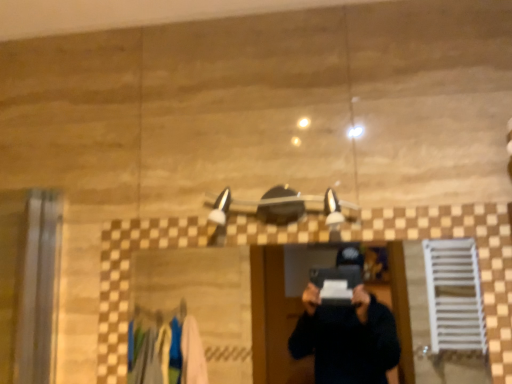
Find the location of a particular element. black glossy mirror at center is located at coordinates (227, 307).

Measure the distance between black glossy mirror at center and camera.

The depth of black glossy mirror at center is 2.61 meters.

Describe the element at coordinates (227, 307) in the screenshot. I see `black glossy mirror at center` at that location.

Find the location of a particular element. black glossy mirror at center is located at coordinates (227, 307).